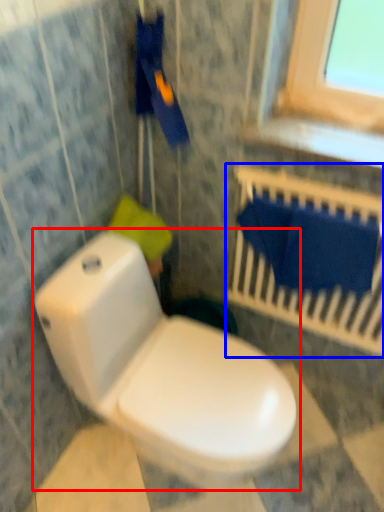
Question: Which point is further to the camera, toilet (highlighted by a red box) or balustrade (highlighted by a blue box)?

Choices:
 (A) toilet
 (B) balustrade

Answer: (B)